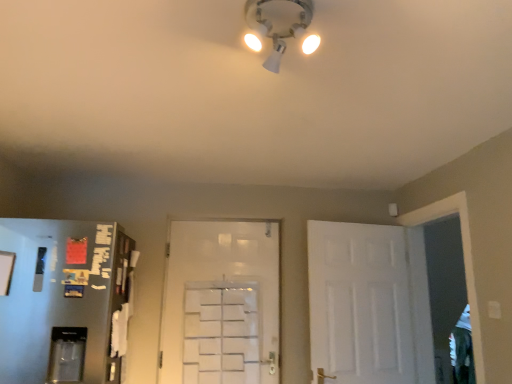
Question: From the image's perspective, would you say white matte door at right, which is counted as the 1th door, starting from the right, is shown under white matte door at center, the 1th door when ordered from left to right?

Choices:
 (A) yes
 (B) no

Answer: (B)

Question: From a real-world perspective, is white matte door at right, which is counted as the 1th door, starting from the right, under white matte door at center, the 1th door when ordered from left to right?

Choices:
 (A) yes
 (B) no

Answer: (A)

Question: Does white matte door at right, which is counted as the 1th door, starting from the right, have a lesser height compared to white matte door at center, marked as the second door in a right-to-left arrangement?

Choices:
 (A) no
 (B) yes

Answer: (B)

Question: Is white matte door at right, the 2th door when ordered from left to right, smaller than white matte door at center, marked as the second door in a right-to-left arrangement?

Choices:
 (A) yes
 (B) no

Answer: (B)

Question: From the image's perspective, is white matte door at right, the 2th door when ordered from left to right, over white matte door at center, marked as the second door in a right-to-left arrangement?

Choices:
 (A) no
 (B) yes

Answer: (B)

Question: Is point (198, 268) positioned closer to the camera than point (245, 14)?

Choices:
 (A) closer
 (B) farther

Answer: (B)

Question: From the image's perspective, is white matte door at center, the 1th door when ordered from left to right, located above or below white plastic light fixture at upper center?

Choices:
 (A) above
 (B) below

Answer: (B)

Question: Choose the correct answer: Is white matte door at center, the 1th door when ordered from left to right, inside white plastic light fixture at upper center or outside it?

Choices:
 (A) outside
 (B) inside

Answer: (A)

Question: Considering the positions of white matte door at center, marked as the second door in a right-to-left arrangement, and white plastic light fixture at upper center in the image, is white matte door at center, marked as the second door in a right-to-left arrangement, bigger or smaller than white plastic light fixture at upper center?

Choices:
 (A) small
 (B) big

Answer: (B)

Question: From the image's perspective, is white matte door at right, which is counted as the 1th door, starting from the right, positioned above or below white plastic light fixture at upper center?

Choices:
 (A) below
 (B) above

Answer: (A)

Question: From their relative heights in the image, would you say white matte door at right, which is counted as the 1th door, starting from the right, is taller or shorter than white plastic light fixture at upper center?

Choices:
 (A) short
 (B) tall

Answer: (B)

Question: Is point (409, 319) closer or farther from the camera than point (260, 43)?

Choices:
 (A) farther
 (B) closer

Answer: (A)

Question: From a real-world perspective, is white matte door at right, which is counted as the 1th door, starting from the right, positioned above or below white plastic light fixture at upper center?

Choices:
 (A) above
 (B) below

Answer: (B)

Question: Is point (231, 321) closer or farther from the camera than point (348, 258)?

Choices:
 (A) farther
 (B) closer

Answer: (A)

Question: Choose the correct answer: Is white matte door at center, the 1th door when ordered from left to right, inside white matte door at right, the 2th door when ordered from left to right, or outside it?

Choices:
 (A) outside
 (B) inside

Answer: (A)